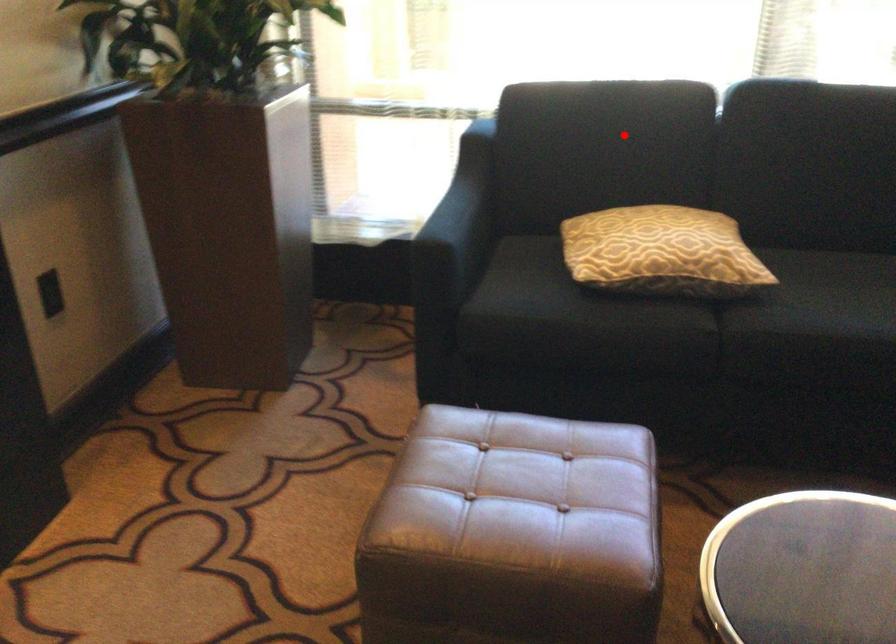
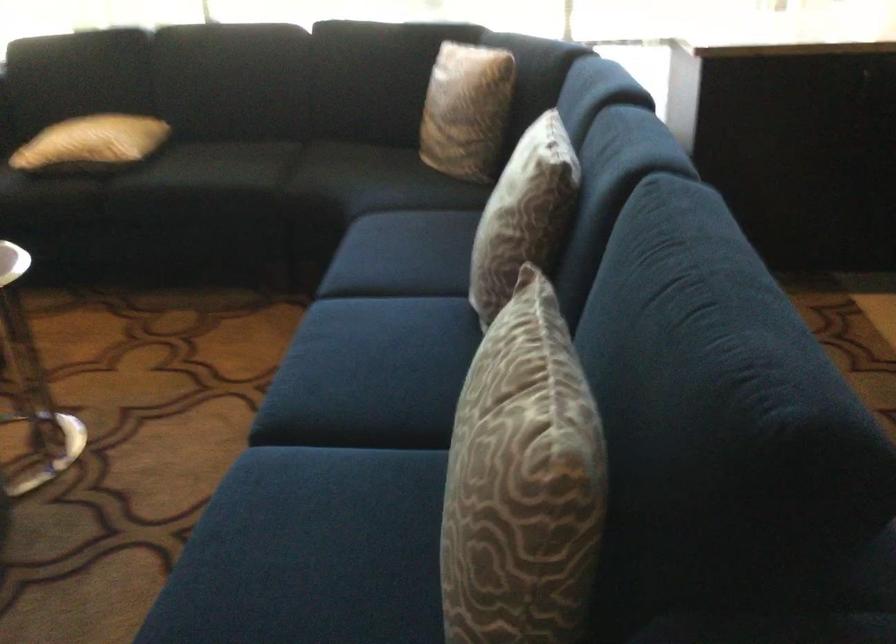
Question: A red point is marked in image1. In image2, is the corresponding 3D point closer to the camera or farther? Reply with the corresponding letter.

Choices:
 (A) The corresponding 3D point is closer.
 (B) The corresponding 3D point is farther.

Answer: (B)